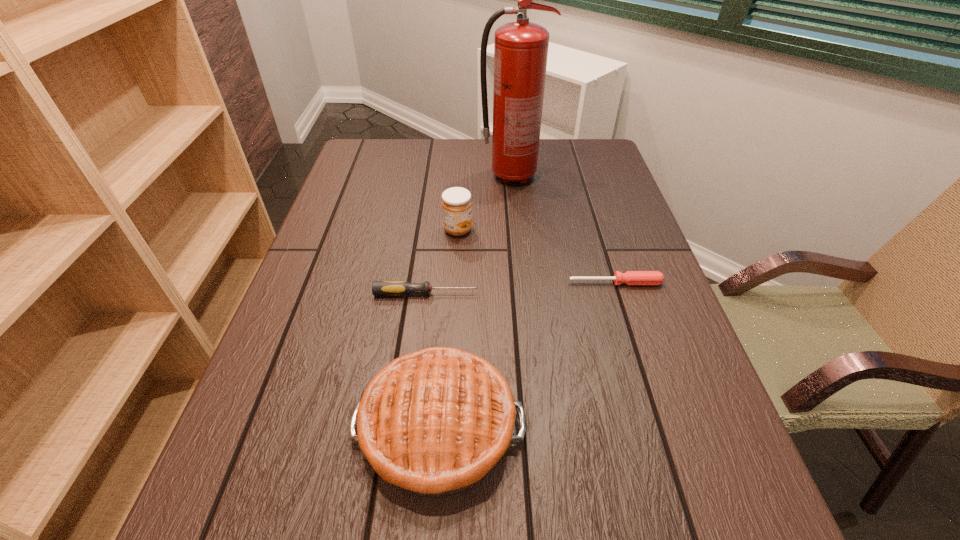
What are the coordinates of `the second closest object to the jam` in the screenshot? It's located at (400, 288).

Image resolution: width=960 pixels, height=540 pixels. What are the coordinates of `free point that satisfies the following two spatial constraints: 1. insert the left screwdriver into a screw head; 2. on the back side of the nearest object` in the screenshot? It's located at (410, 427).

I want to click on vacant space that satisfies the following two spatial constraints: 1. insert the nearest object into a screw head; 2. on the left side of the left screwdriver, so click(410, 427).

The width and height of the screenshot is (960, 540). What are the coordinates of `free location that satisfies the following two spatial constraints: 1. insert the pie into a screw head; 2. on the left side of the second nearest object` in the screenshot? It's located at (410, 427).

Find the location of `vacant area in the image that satisfies the following two spatial constraints: 1. on the handle side the fire extinguisher; 2. on the front side of the pie`. vacant area in the image that satisfies the following two spatial constraints: 1. on the handle side the fire extinguisher; 2. on the front side of the pie is located at coordinates (537, 427).

At what (x,y) coordinates should I click in order to perform the action: click on free space that satisfies the following two spatial constraints: 1. on the front label of the fourth nearest object; 2. on the back side of the farther screwdriver. Please return your answer as a coordinate pair (x, y). Image resolution: width=960 pixels, height=540 pixels. Looking at the image, I should click on (455, 283).

Identify the location of blank space that satisfies the following two spatial constraints: 1. on the handle side the fire extinguisher; 2. on the left side of the right screwdriver. point(522,283).